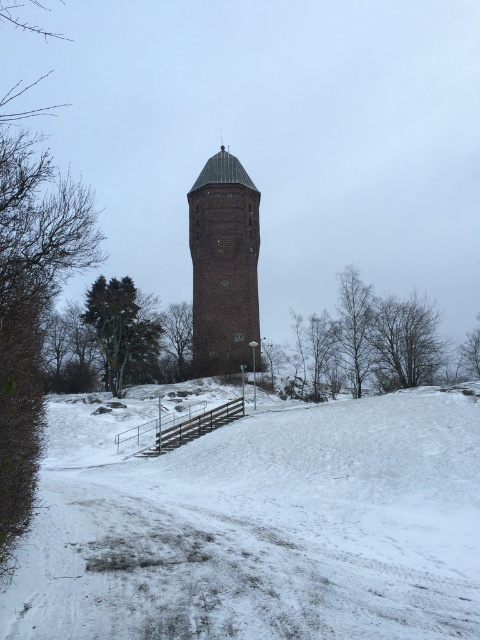
Question: Which of the following is the closest to the observer?

Choices:
 (A) snowy grass at lower left
 (B) brown brick tower at center

Answer: (A)

Question: Does snowy grass at lower left have a larger size compared to brown brick tower at center?

Choices:
 (A) yes
 (B) no

Answer: (B)

Question: Which of the following is the closest to the observer?

Choices:
 (A) (129, 481)
 (B) (210, 200)

Answer: (A)

Question: Does snowy grass at lower left have a smaller size compared to brown brick tower at center?

Choices:
 (A) no
 (B) yes

Answer: (B)

Question: Does snowy grass at lower left have a larger size compared to brown brick tower at center?

Choices:
 (A) yes
 (B) no

Answer: (B)

Question: Which point is farther to the camera?

Choices:
 (A) (391, 452)
 (B) (197, 301)

Answer: (B)